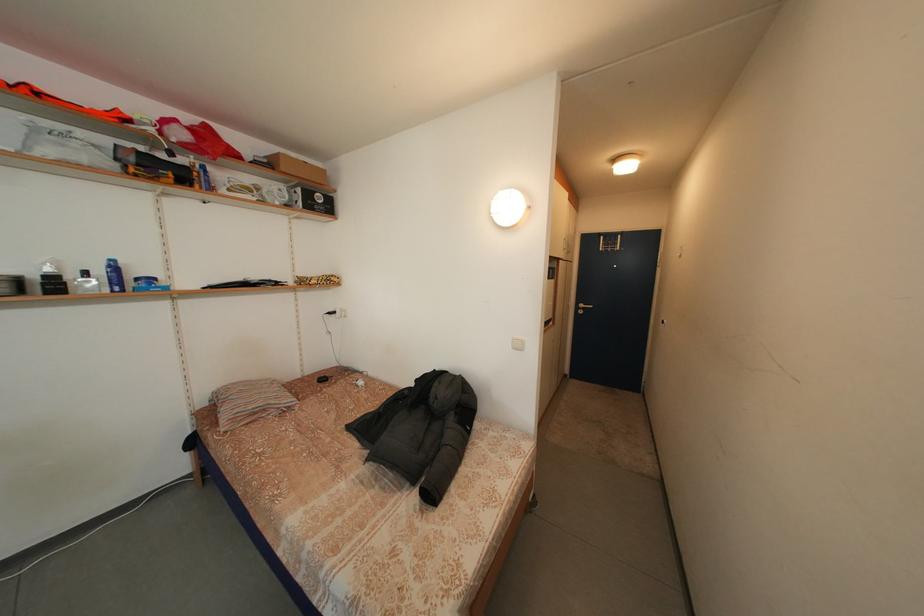
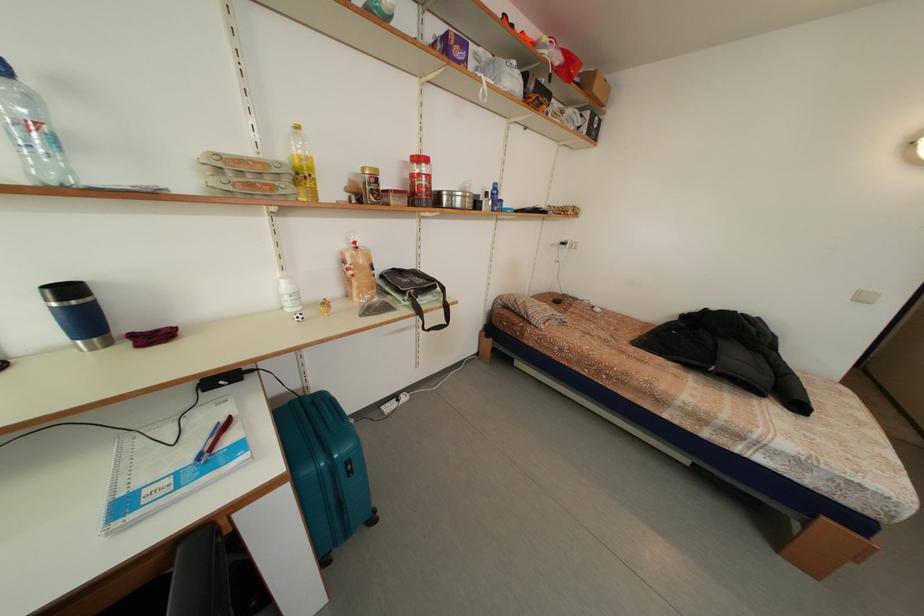
In the second image, find the point that corresponds to the point at 292,175 in the first image.

(603, 95)